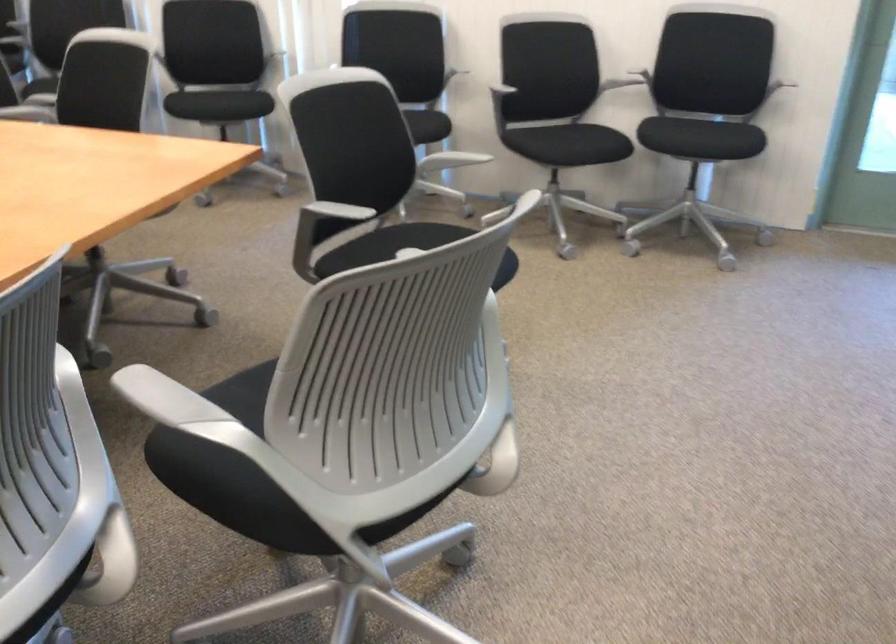
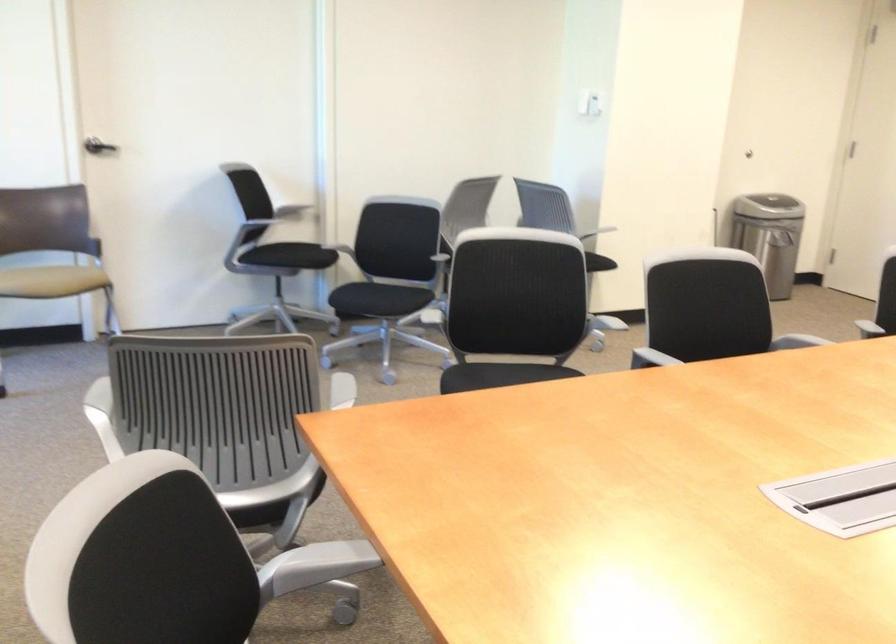
Question: I am providing you with two images of the same scene from different viewpoints. Please identify which objects are invisible in image2.

Choices:
 (A) closed drawer front
 (B) metal trash can
 (C) chair armrest
 (D) gray chair armrest

Answer: (D)